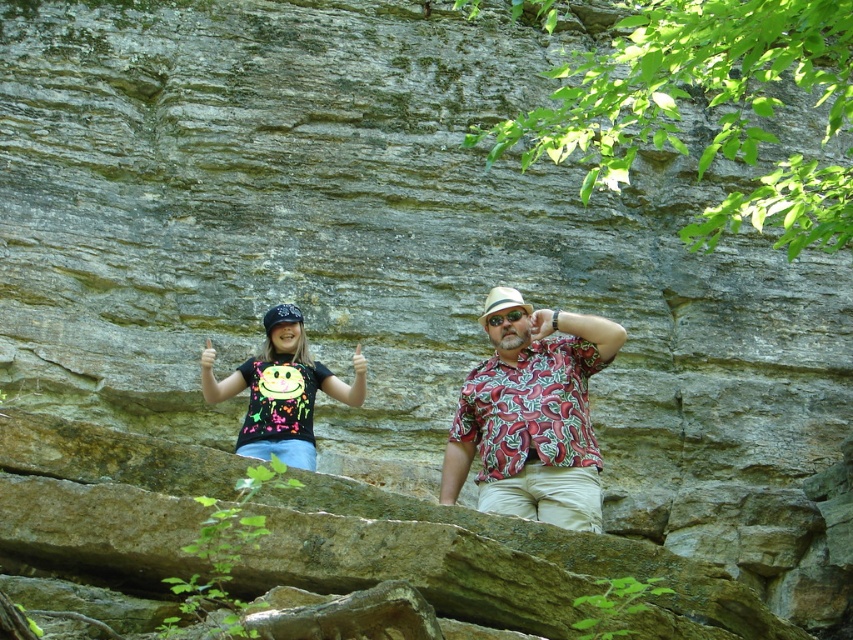
Describe the element at coordinates (532, 413) in the screenshot. The height and width of the screenshot is (640, 853). I see `black printed shirt at center` at that location.

Find the location of a particular element. Image resolution: width=853 pixels, height=640 pixels. black printed shirt at center is located at coordinates (532, 413).

Can you confirm if black printed shirt at center is positioned to the right of neon fabric shirt at lower left?

Indeed, black printed shirt at center is positioned on the right side of neon fabric shirt at lower left.

Between point (550, 385) and point (310, 458), which one is positioned in front?

Point (550, 385)

The width and height of the screenshot is (853, 640). In order to click on black printed shirt at center in this screenshot , I will do `click(532, 413)`.

Which of these two, printed fabric shirt at center or neon fabric shirt at lower left, stands taller?

printed fabric shirt at center is taller.

Is point (532, 420) positioned in front of point (306, 372)?

Yes, point (532, 420) is closer to viewer.

Find the location of a particular element. This screenshot has height=640, width=853. printed fabric shirt at center is located at coordinates (532, 413).